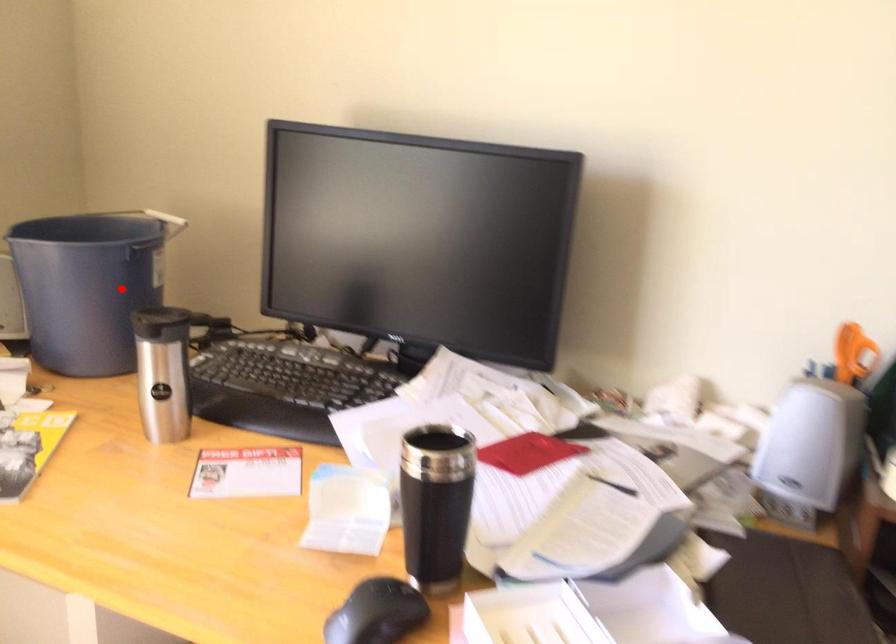
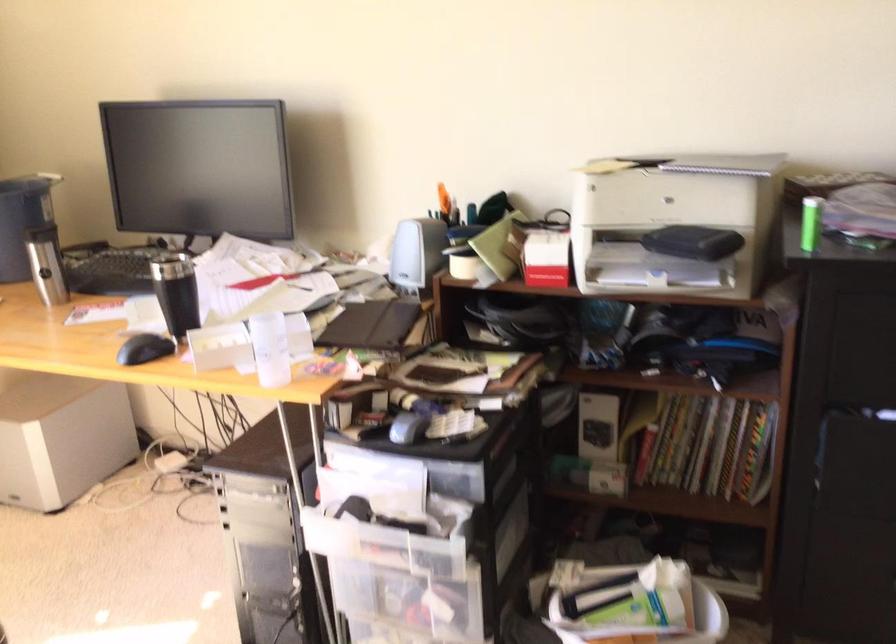
Question: I am providing you with two images of the same scene from different viewpoints. A red point is marked on the first image. At the location where the point appears in image 1, is it still visible in image 2?

Choices:
 (A) Yes
 (B) No

Answer: (A)